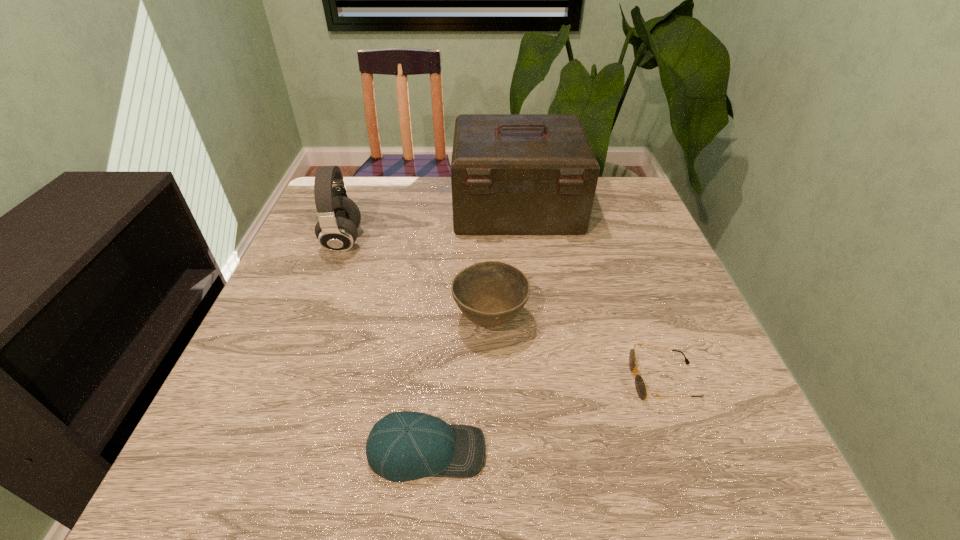
Identify the location of vacant space located 0.330m on the ear cups of the headset. This screenshot has width=960, height=540. (492, 241).

The image size is (960, 540). I want to click on free region located 0.230m on the back of the third nearest object, so click(x=488, y=233).

Where is `free point located on the back of the nearest object`? The image size is (960, 540). free point located on the back of the nearest object is located at coordinates (436, 356).

Identify the location of free space located on the front-facing side of the fourth farthest object. (518, 380).

You are a GUI agent. You are given a task and a screenshot of the screen. Output one action in this format:
    pyautogui.click(x=<x>, y=<y>)
    Task: Click on the free space located 0.200m on the front-facing side of the fourth farthest object
    
    Given the screenshot: What is the action you would take?
    pyautogui.click(x=523, y=380)

At what (x,y) coordinates should I click in order to perform the action: click on blank area located on the front-facing side of the fourth farthest object. Please return your answer as a coordinate pair (x, y). Looking at the image, I should click on (421, 380).

I want to click on the first-aid kit present at the far edge, so click(511, 174).

This screenshot has width=960, height=540. Identify the location of headset present at the far edge. (339, 217).

Find the location of a particular element. object located in the near edge section of the desktop is located at coordinates (402, 446).

Find the location of `object positioned at the left edge`. object positioned at the left edge is located at coordinates (339, 217).